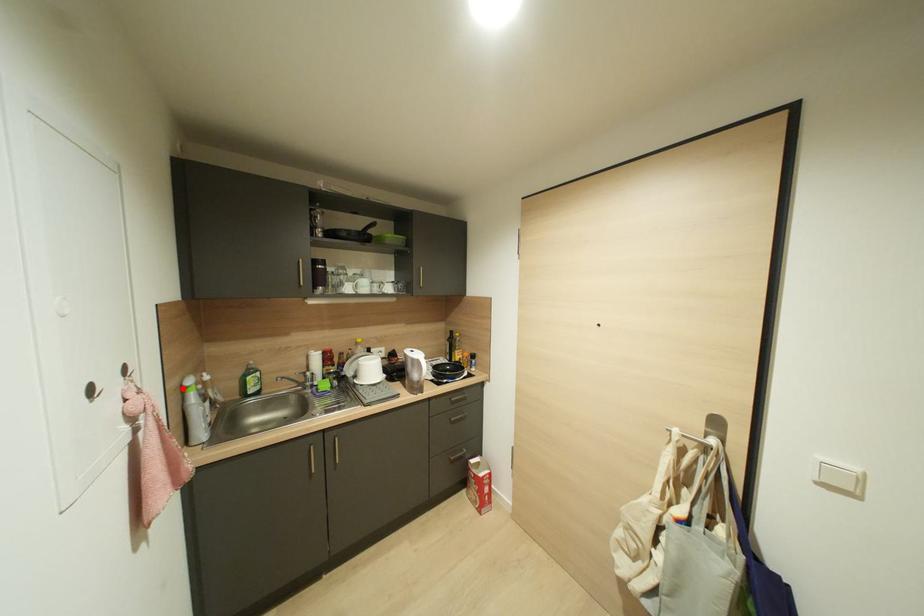
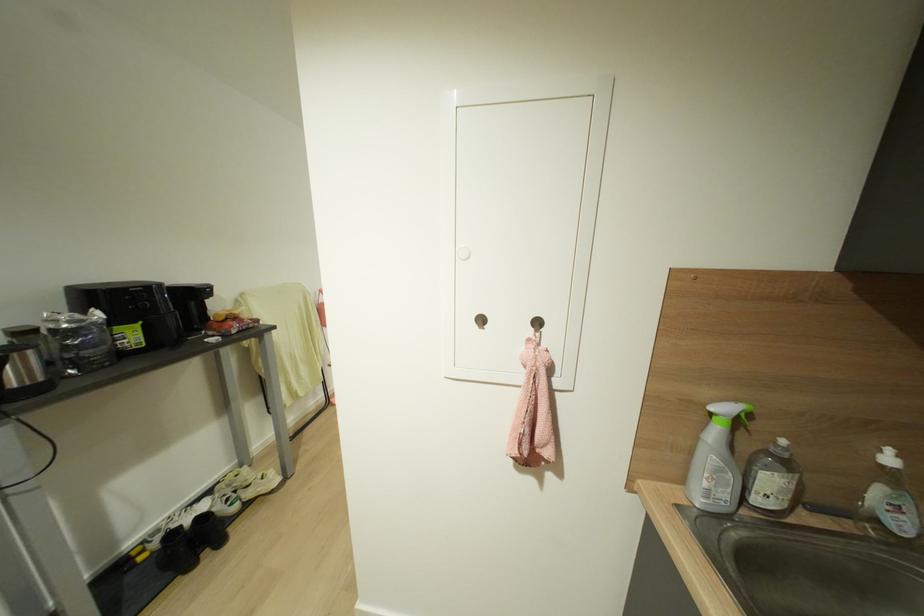
Find the pixel in the second image that matches the highlighted location in the first image.

(711, 411)